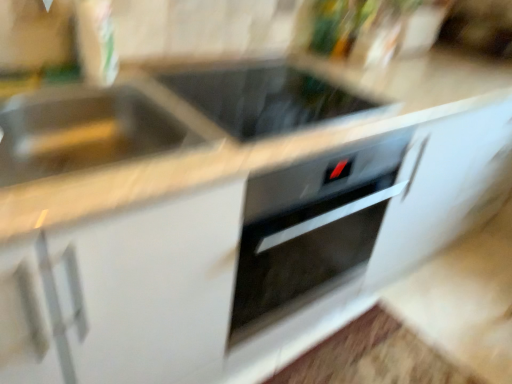
Question: Considering the positions of metallic silver sink at left and black glass cooktop at center in the image, is metallic silver sink at left bigger or smaller than black glass cooktop at center?

Choices:
 (A) big
 (B) small

Answer: (A)

Question: Considering the relative positions of metallic silver sink at left and black glass cooktop at center in the image provided, is metallic silver sink at left to the left or to the right of black glass cooktop at center?

Choices:
 (A) left
 (B) right

Answer: (A)

Question: Considering their positions, is metallic silver sink at left located in front of or behind black glass cooktop at center?

Choices:
 (A) front
 (B) behind

Answer: (A)

Question: From their relative heights in the image, would you say black glass cooktop at center is taller or shorter than metallic silver sink at left?

Choices:
 (A) short
 (B) tall

Answer: (A)

Question: Based on their positions, is black glass cooktop at center located to the left or right of metallic silver sink at left?

Choices:
 (A) left
 (B) right

Answer: (B)

Question: Considering the positions of point (294, 112) and point (33, 122), is point (294, 112) closer or farther from the camera than point (33, 122)?

Choices:
 (A) closer
 (B) farther

Answer: (B)

Question: From the image's perspective, is black glass cooktop at center located above or below metallic silver sink at left?

Choices:
 (A) below
 (B) above

Answer: (B)